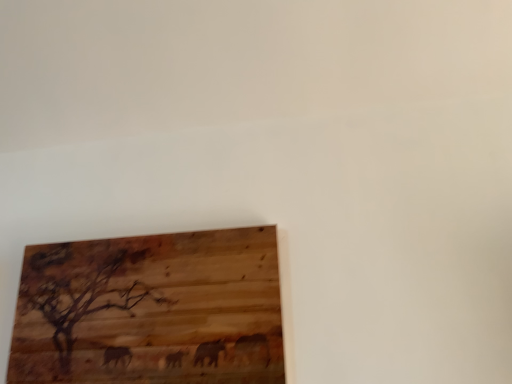
The image size is (512, 384). What do you see at coordinates (151, 310) in the screenshot? I see `wooden painting at lower left` at bounding box center [151, 310].

Image resolution: width=512 pixels, height=384 pixels. In order to click on wooden painting at lower left in this screenshot , I will do `click(151, 310)`.

At what (x,y) coordinates should I click in order to perform the action: click on wooden painting at lower left. Please return your answer as a coordinate pair (x, y). Looking at the image, I should click on (151, 310).